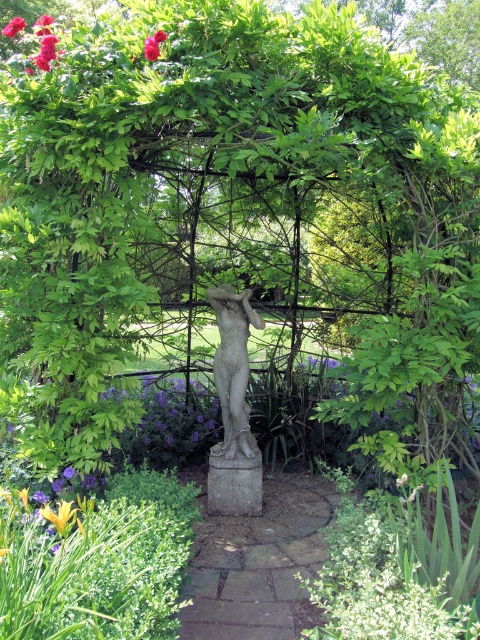
Which of these two, purple matte flower at center or red matte flower at upper left, stands taller?

purple matte flower at center

Is purple matte flower at center positioned in front of red matte flower at upper left?

No.

Which is behind, point (178, 388) or point (12, 35)?

Positioned behind is point (178, 388).

Image resolution: width=480 pixels, height=640 pixels. Find the location of `purple matte flower at center`. purple matte flower at center is located at coordinates (173, 419).

Measure the distance between point (58,509) and camera.

Point (58,509) and camera are 2.35 meters apart.

Where is `yellow/yellowish-green petal at lower left`? The image size is (480, 640). yellow/yellowish-green petal at lower left is located at coordinates (60, 516).

Measure the distance between yellow/yellowish-green petal at lower left and camera.

6.23 feet

In order to click on yellow/yellowish-green petal at lower left in this screenshot , I will do `click(60, 516)`.

Can you confirm if matte pink flower at upper left is shorter than bright pink petals at upper left?

No.

Is point (50, 42) farther from viewer compared to point (154, 45)?

Yes, it is behind point (154, 45).

Where is `matte pink flower at upper left`? matte pink flower at upper left is located at coordinates (46, 51).